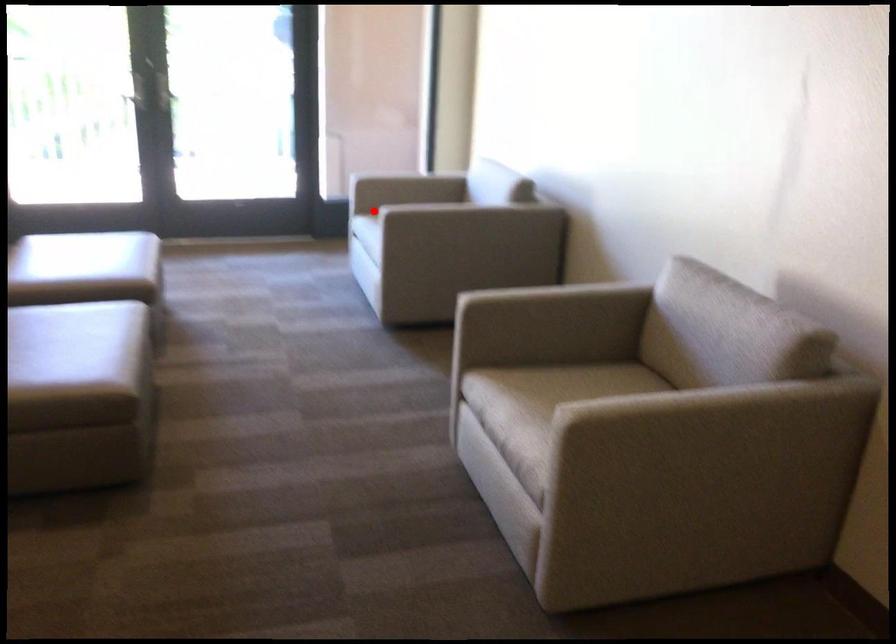
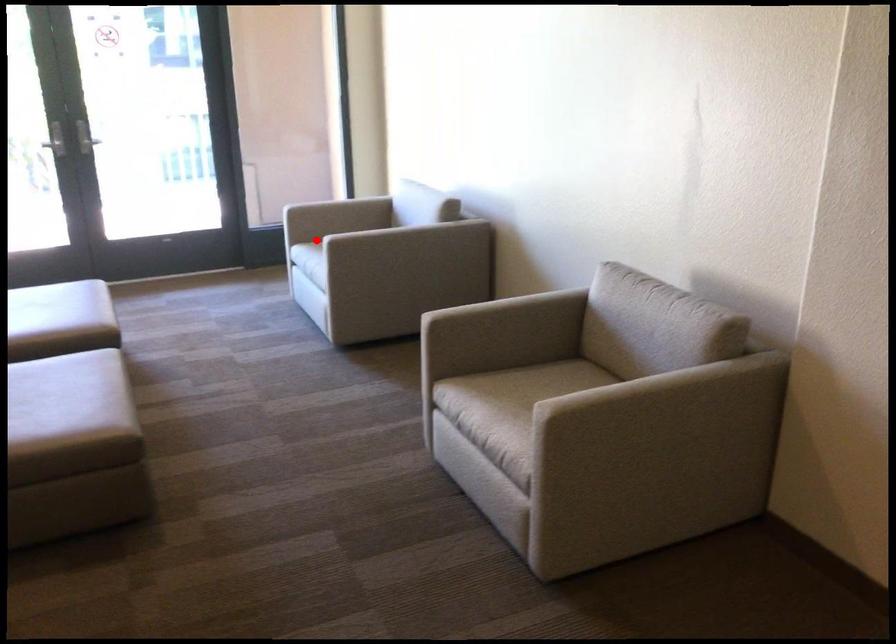
I am providing you with two images of the same scene from different viewpoints. A red point is marked on the first image and another point is marked on the second image. Are the points marked in image1 and image2 representing the same 3D position?

Yes